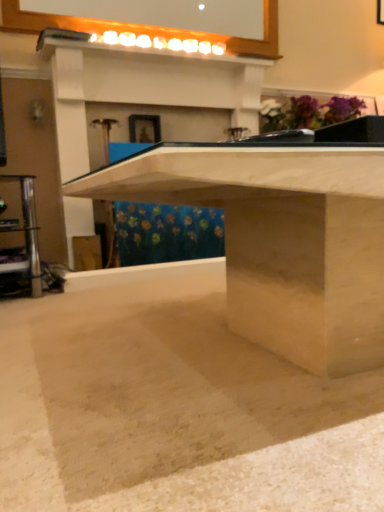
What do you see at coordinates (281, 240) in the screenshot? The height and width of the screenshot is (512, 384). I see `sanded wood table at center` at bounding box center [281, 240].

The width and height of the screenshot is (384, 512). What are the coordinates of `sanded wood table at center` in the screenshot? It's located at (281, 240).

Considering the sizes of smooth concrete at center and matte gold picture frame at upper center in the image, is smooth concrete at center bigger or smaller than matte gold picture frame at upper center?

In the image, smooth concrete at center appears to be larger than matte gold picture frame at upper center.

Is smooth concrete at center facing towards matte gold picture frame at upper center?

No, smooth concrete at center is not facing towards matte gold picture frame at upper center.

Is smooth concrete at center taller or shorter than matte gold picture frame at upper center?

In the image, smooth concrete at center appears to be shorter than matte gold picture frame at upper center.

Considering the points (300, 461) and (142, 127), which point is behind, point (300, 461) or point (142, 127)?

The point (142, 127) is behind.

From the image's perspective, would you say sanded wood table at center is shown under matte gold picture frame at upper center?

Correct, sanded wood table at center appears lower than matte gold picture frame at upper center in the image.

Considering the sizes of objects sanded wood table at center and matte gold picture frame at upper center in the image provided, who is bigger, sanded wood table at center or matte gold picture frame at upper center?

sanded wood table at center.

Can we say sanded wood table at center lies outside matte gold picture frame at upper center?

sanded wood table at center lies outside matte gold picture frame at upper center's area.

Considering the sizes of objects matte gold picture frame at upper center and sanded wood table at center in the image provided, who is taller, matte gold picture frame at upper center or sanded wood table at center?

sanded wood table at center is taller.

Which point is more distant from viewer, (141, 141) or (323, 295)?

The point (141, 141) is farther from the camera.

From the image's perspective, which object appears higher, matte gold picture frame at upper center or sanded wood table at center?

matte gold picture frame at upper center is shown above in the image.

Locate an element on the screen. picture frame positioned vertically above the sanded wood table at center (from a real-world perspective) is located at coordinates (144, 128).

Is matte gold picture frame at upper center to the left of smooth concrete at center from the viewer's perspective?

Correct, you'll find matte gold picture frame at upper center to the left of smooth concrete at center.

Can you confirm if matte gold picture frame at upper center is bigger than smooth concrete at center?

Actually, matte gold picture frame at upper center might be smaller than smooth concrete at center.

Who is shorter, matte gold picture frame at upper center or smooth concrete at center?

Standing shorter between the two is smooth concrete at center.

Based on the photo, does matte gold picture frame at upper center have a lesser width compared to smooth concrete at center?

Yes, matte gold picture frame at upper center is thinner than smooth concrete at center.

Does smooth concrete at center turn towards sanded wood table at center?

No, smooth concrete at center is not aimed at sanded wood table at center.

Considering the sizes of smooth concrete at center and sanded wood table at center in the image, is smooth concrete at center wider or thinner than sanded wood table at center?

Clearly, smooth concrete at center has more width compared to sanded wood table at center.

In terms of size, does smooth concrete at center appear bigger or smaller than sanded wood table at center?

Clearly, smooth concrete at center is smaller in size than sanded wood table at center.

Is smooth concrete at center touching sanded wood table at center?

No, smooth concrete at center is not making contact with sanded wood table at center.

Which of these two, sanded wood table at center or smooth concrete at center, is wider?

With larger width is smooth concrete at center.

In terms of height, does sanded wood table at center look taller or shorter compared to smooth concrete at center?

Considering their sizes, sanded wood table at center has more height than smooth concrete at center.

Is sanded wood table at center outside of smooth concrete at center?

Yes, sanded wood table at center is outside of smooth concrete at center.

Is sanded wood table at center further to the viewer compared to smooth concrete at center?

Yes.

Locate an element on the screen. This screenshot has width=384, height=512. concrete below the matte gold picture frame at upper center (from a real-world perspective) is located at coordinates (172, 405).

I want to click on picture frame above the sanded wood table at center (from the image's perspective), so click(144, 128).

Estimate the real-world distances between objects in this image. Which object is further from sanded wood table at center, smooth concrete at center or matte gold picture frame at upper center?

matte gold picture frame at upper center is positioned further to the anchor sanded wood table at center.

Looking at the image, which one is located further to smooth concrete at center, matte gold picture frame at upper center or sanded wood table at center?

matte gold picture frame at upper center is positioned further to the anchor smooth concrete at center.

Which object lies further to the anchor point matte gold picture frame at upper center, sanded wood table at center or smooth concrete at center?

smooth concrete at center is positioned further to the anchor matte gold picture frame at upper center.

Which object lies nearer to the anchor point sanded wood table at center, matte gold picture frame at upper center or smooth concrete at center?

The object closer to sanded wood table at center is smooth concrete at center.

Based on their spatial positions, is smooth concrete at center or sanded wood table at center closer to matte gold picture frame at upper center?

sanded wood table at center lies closer to matte gold picture frame at upper center than the other object.

Which object lies nearer to the anchor point smooth concrete at center, sanded wood table at center or matte gold picture frame at upper center?

sanded wood table at center.

At what (x,y) coordinates should I click in order to perform the action: click on table positioned between smooth concrete at center and matte gold picture frame at upper center from near to far. Please return your answer as a coordinate pair (x, y). Looking at the image, I should click on (281, 240).